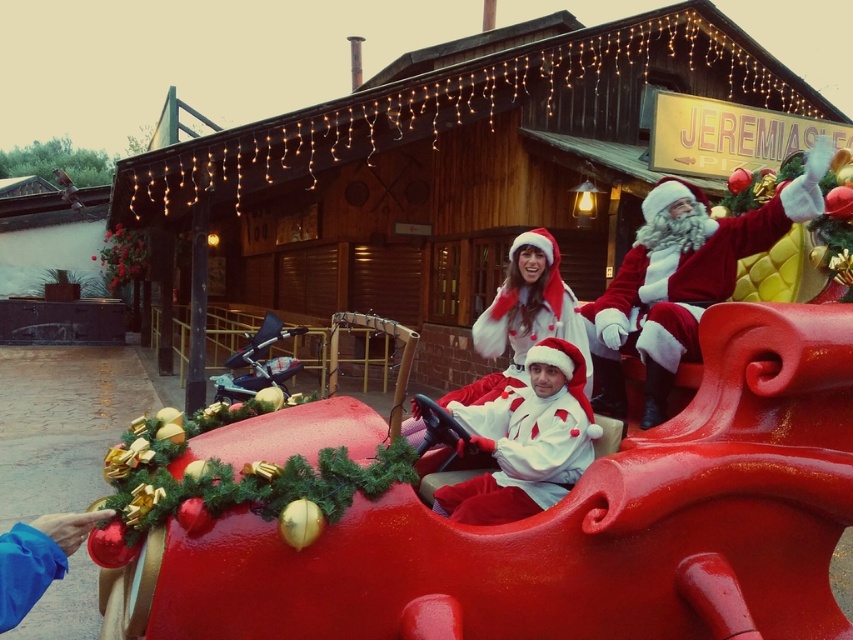
Question: Which point is closer to the camera?

Choices:
 (A) velvet red santa at upper right
 (B) matte white santa at center

Answer: (B)

Question: Among these points, which one is nearest to the camera?

Choices:
 (A) (807, 156)
 (B) (529, 465)

Answer: (B)

Question: Which point appears farthest from the camera in this image?

Choices:
 (A) (543, 388)
 (B) (618, 285)

Answer: (B)

Question: Is velvet red santa at upper right wider than matte white santa at center?

Choices:
 (A) no
 (B) yes

Answer: (B)

Question: Does velvet red santa at upper right have a lesser width compared to matte white santa at center?

Choices:
 (A) no
 (B) yes

Answer: (A)

Question: Is velvet red santa at upper right below matte white santa at center?

Choices:
 (A) no
 (B) yes

Answer: (A)